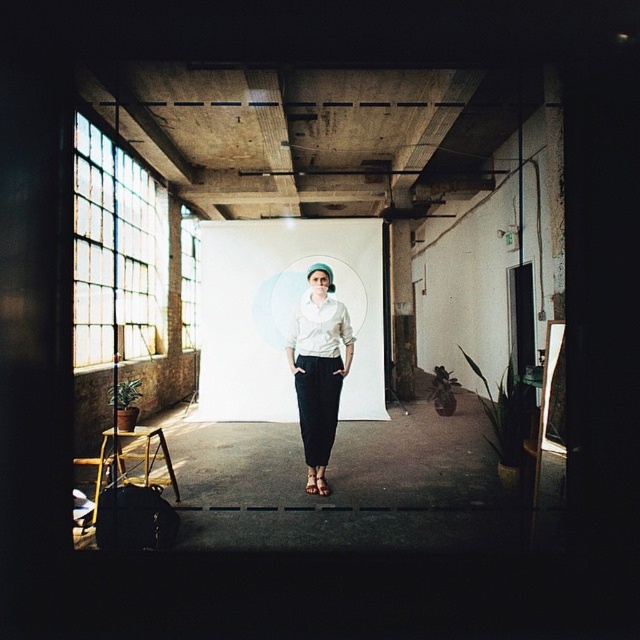
Is white matte blouse at center to the left of brown leather sandal at center from the viewer's perspective?

No, white matte blouse at center is not to the left of brown leather sandal at center.

Is white matte blouse at center in front of brown leather sandal at center?

No.

Describe the element at coordinates (320, 326) in the screenshot. I see `white matte blouse at center` at that location.

Where is `white matte blouse at center`? white matte blouse at center is located at coordinates (320, 326).

Is white matte shirt at center behind matte pink sandal at center?

Yes, white matte shirt at center is further from the viewer.

What do you see at coordinates (317, 364) in the screenshot? The height and width of the screenshot is (640, 640). I see `white matte shirt at center` at bounding box center [317, 364].

The image size is (640, 640). I want to click on white matte shirt at center, so click(317, 364).

Can you confirm if white matte blouse at center is shorter than matte pink sandal at center?

Incorrect, white matte blouse at center's height does not fall short of matte pink sandal at center's.

The width and height of the screenshot is (640, 640). Identify the location of white matte blouse at center. (320, 326).